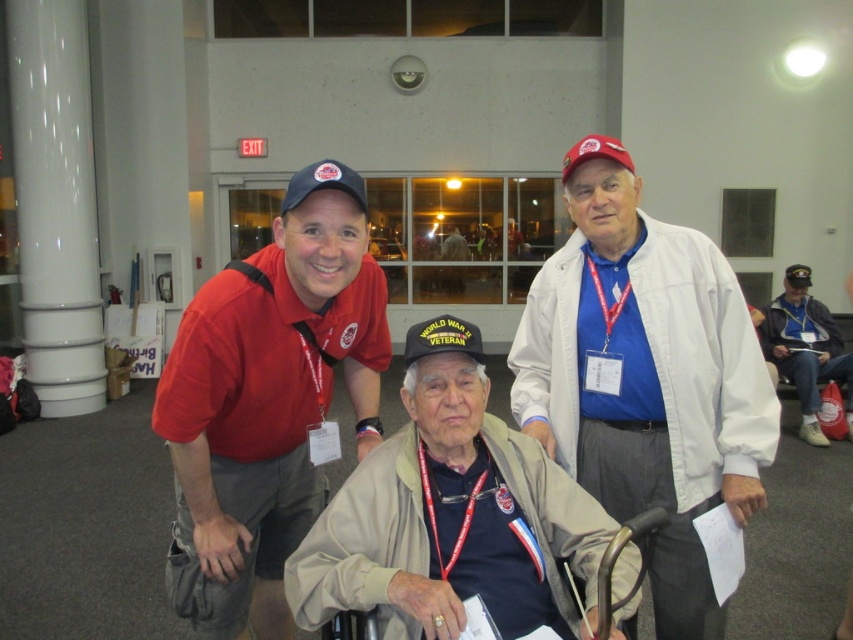
Question: Which object is closer to the camera taking this photo?

Choices:
 (A) matte red shirt at left
 (B) blue denim jacket at lower right
 (C) white cotton jacket at upper right

Answer: (A)

Question: Which point appears farthest from the camera in this image?

Choices:
 (A) (325, 285)
 (B) (643, 484)
 (C) (802, 420)
 (D) (646, 563)

Answer: (C)

Question: Is matte red shirt at left above beige fabric wheelchair at center?

Choices:
 (A) yes
 (B) no

Answer: (A)

Question: Does blue denim jacket at lower right lie in front of beige fabric wheelchair at center?

Choices:
 (A) no
 (B) yes

Answer: (A)

Question: Observing the image, what is the correct spatial positioning of matte red shirt at left in reference to beige fabric wheelchair at center?

Choices:
 (A) left
 (B) right

Answer: (A)

Question: Which point is farther to the camera?

Choices:
 (A) pos(320,492)
 (B) pos(778,365)
 (C) pos(456,403)

Answer: (B)